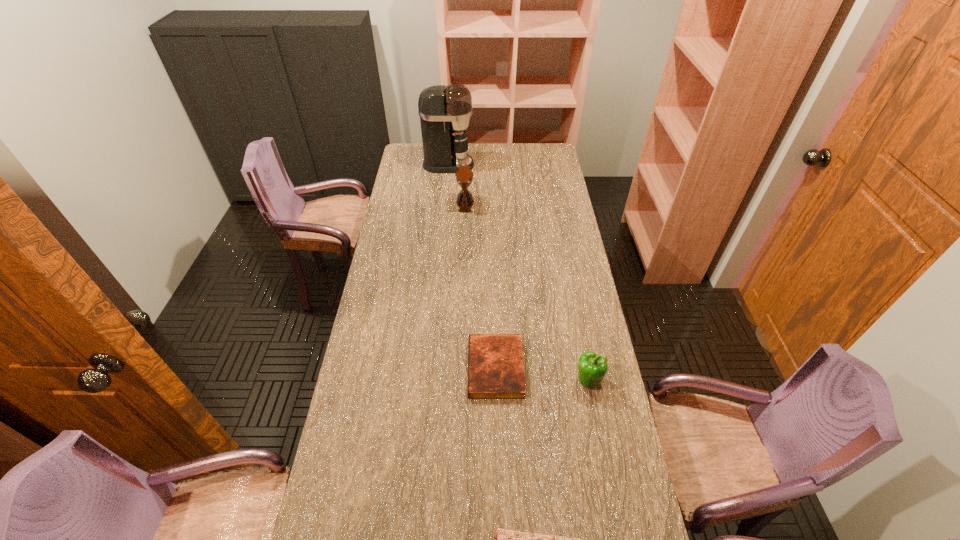
Where is `vacant region located 0.130m on the spine side of the taller Bible`? The image size is (960, 540). vacant region located 0.130m on the spine side of the taller Bible is located at coordinates (427, 368).

You are a GUI agent. You are given a task and a screenshot of the screen. Output one action in this format:
    pyautogui.click(x=<x>, y=<y>)
    Task: Click on the free space located on the spine side of the taller Bible
    
    Given the screenshot: What is the action you would take?
    pyautogui.click(x=377, y=368)

The width and height of the screenshot is (960, 540). Identify the location of object present at the far edge. (445, 111).

Where is `object positioned at the left edge`? This screenshot has height=540, width=960. object positioned at the left edge is located at coordinates (445, 111).

The image size is (960, 540). I want to click on object that is positioned at the right edge, so click(592, 367).

What are the coordinates of `object that is at the far left corner` in the screenshot? It's located at (445, 111).

This screenshot has height=540, width=960. In order to click on free space at the far edge in this screenshot , I will do `click(492, 157)`.

What are the coordinates of `vacant region at the left edge of the desktop` in the screenshot? It's located at (393, 257).

The height and width of the screenshot is (540, 960). I want to click on vacant space at the right edge of the desktop, so click(x=551, y=249).

Locate an element on the screen. The image size is (960, 540). unoccupied position between the fourth tallest object and the rightmost object is located at coordinates (541, 374).